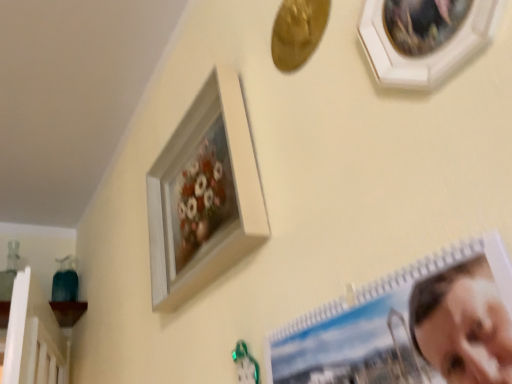
Question: Considering the relative sizes of spiral-bound photo album at lower right, arranged as the first picture frame when viewed from the front, and white matte picture frame at upper center, which ranks as the 1th picture frame in back-to-front order, in the image provided, is spiral-bound photo album at lower right, arranged as the first picture frame when viewed from the front, wider than white matte picture frame at upper center, which ranks as the 1th picture frame in back-to-front order,?

Choices:
 (A) no
 (B) yes

Answer: (A)

Question: Considering the relative sizes of spiral-bound photo album at lower right, placed as the third picture frame when sorted from back to front, and white matte picture frame at upper center, the 3th picture frame in the front-to-back sequence, in the image provided, is spiral-bound photo album at lower right, placed as the third picture frame when sorted from back to front, bigger than white matte picture frame at upper center, the 3th picture frame in the front-to-back sequence,?

Choices:
 (A) yes
 (B) no

Answer: (A)

Question: Is spiral-bound photo album at lower right, placed as the third picture frame when sorted from back to front, positioned before white matte picture frame at upper center, the 3th picture frame in the front-to-back sequence?

Choices:
 (A) no
 (B) yes

Answer: (B)

Question: From a real-world perspective, does spiral-bound photo album at lower right, arranged as the first picture frame when viewed from the front, sit lower than white matte picture frame at upper center, the 3th picture frame in the front-to-back sequence?

Choices:
 (A) no
 (B) yes

Answer: (B)

Question: Is spiral-bound photo album at lower right, placed as the third picture frame when sorted from back to front, looking in the opposite direction of white matte picture frame at upper center, the 3th picture frame in the front-to-back sequence?

Choices:
 (A) yes
 (B) no

Answer: (B)

Question: Based on their sizes in the image, would you say white wooden picture frame at upper right, the second picture frame when ordered from back to front, is bigger or smaller than white matte picture frame at upper center, the 3th picture frame in the front-to-back sequence?

Choices:
 (A) small
 (B) big

Answer: (A)

Question: Which is correct: white wooden picture frame at upper right, which appears as the 2th picture frame when viewed from the front, is inside white matte picture frame at upper center, the 3th picture frame in the front-to-back sequence, or outside of it?

Choices:
 (A) outside
 (B) inside

Answer: (A)

Question: Is point (456, 54) closer or farther from the camera than point (245, 236)?

Choices:
 (A) closer
 (B) farther

Answer: (A)

Question: From a real-world perspective, is white wooden picture frame at upper right, the second picture frame when ordered from back to front, above or below white matte picture frame at upper center, the 3th picture frame in the front-to-back sequence?

Choices:
 (A) below
 (B) above

Answer: (A)

Question: Does point (485, 21) appear closer or farther from the camera than point (494, 347)?

Choices:
 (A) closer
 (B) farther

Answer: (B)

Question: Based on their positions, is white wooden picture frame at upper right, which appears as the 2th picture frame when viewed from the front, located to the left or right of spiral-bound photo album at lower right, arranged as the first picture frame when viewed from the front?

Choices:
 (A) left
 (B) right

Answer: (B)

Question: From their relative heights in the image, would you say white wooden picture frame at upper right, the second picture frame when ordered from back to front, is taller or shorter than spiral-bound photo album at lower right, placed as the third picture frame when sorted from back to front?

Choices:
 (A) tall
 (B) short

Answer: (B)

Question: Is white wooden picture frame at upper right, which appears as the 2th picture frame when viewed from the front, inside the boundaries of spiral-bound photo album at lower right, placed as the third picture frame when sorted from back to front, or outside?

Choices:
 (A) outside
 (B) inside

Answer: (A)

Question: Is white matte picture frame at upper center, which ranks as the 1th picture frame in back-to-front order, inside the boundaries of white wooden picture frame at upper right, which appears as the 2th picture frame when viewed from the front, or outside?

Choices:
 (A) inside
 (B) outside

Answer: (B)

Question: In terms of size, does white matte picture frame at upper center, which ranks as the 1th picture frame in back-to-front order, appear bigger or smaller than white wooden picture frame at upper right, which appears as the 2th picture frame when viewed from the front?

Choices:
 (A) big
 (B) small

Answer: (A)